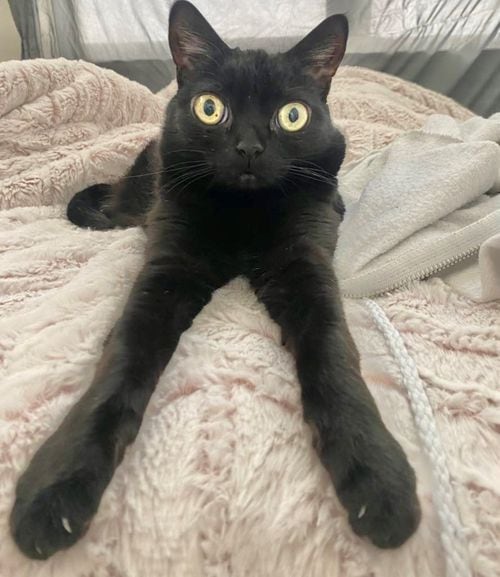
This screenshot has height=577, width=500. Identify the location of fabric against wall. (437, 31), (119, 44).